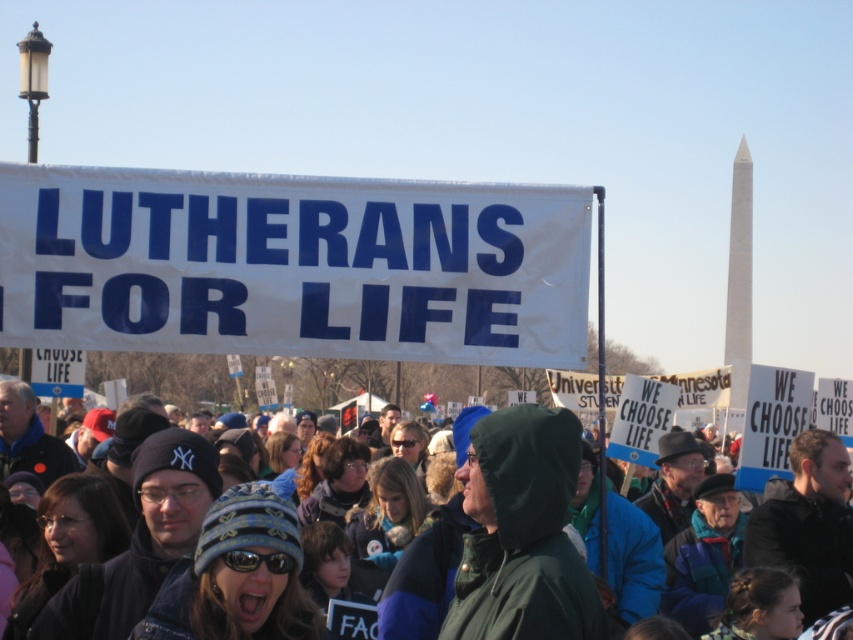
Can you confirm if white paper banner at center is bigger than green hooded jacket at center?

Actually, white paper banner at center might be smaller than green hooded jacket at center.

Is white paper banner at center positioned in front of green hooded jacket at center?

No, it is not.

Does point (80, 188) come in front of point (842, 548)?

That is True.

Find the location of a particular element. white paper banner at center is located at coordinates (292, 266).